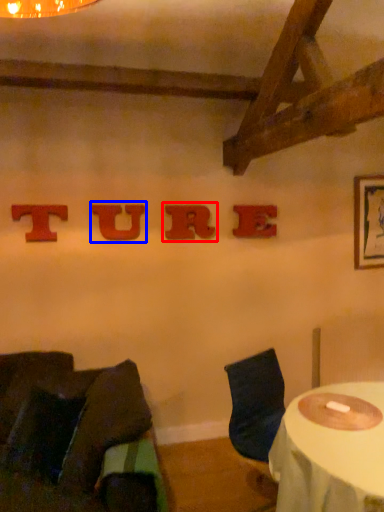
Question: Which of the following is the farthest to the observer, alphabet (highlighted by a red box) or alphabet (highlighted by a blue box)?

Choices:
 (A) alphabet
 (B) alphabet

Answer: (A)